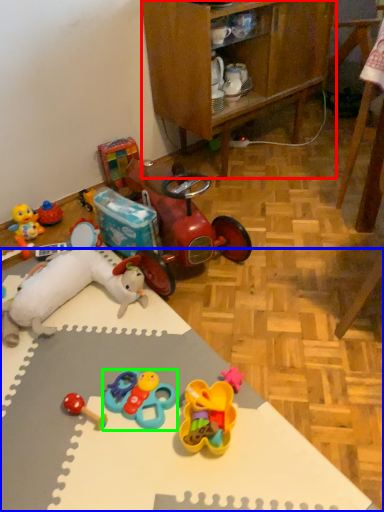
Question: Which is farther away from cabinetry (highlighted by a red box)? desk (highlighted by a blue box) or toy (highlighted by a green box)?

Choices:
 (A) desk
 (B) toy

Answer: (B)